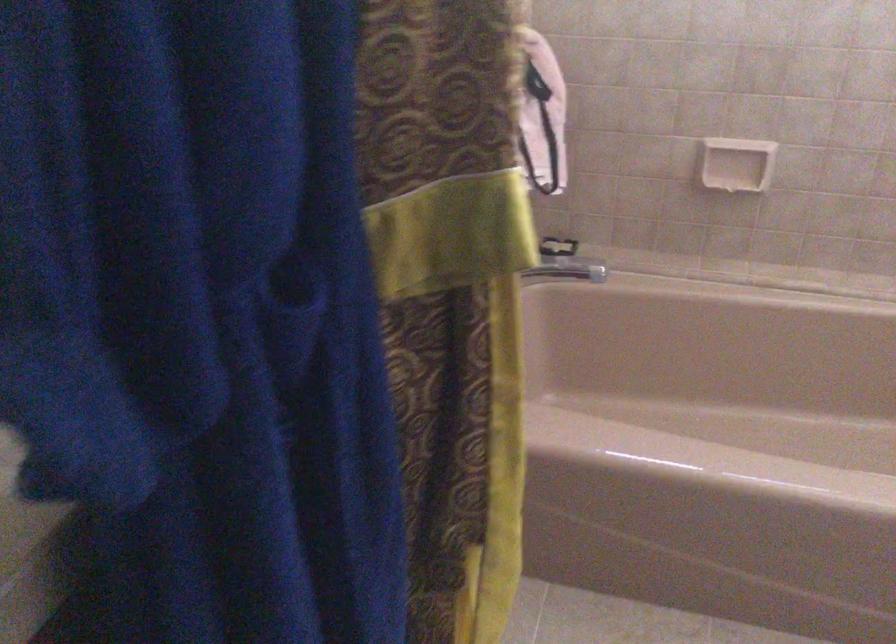
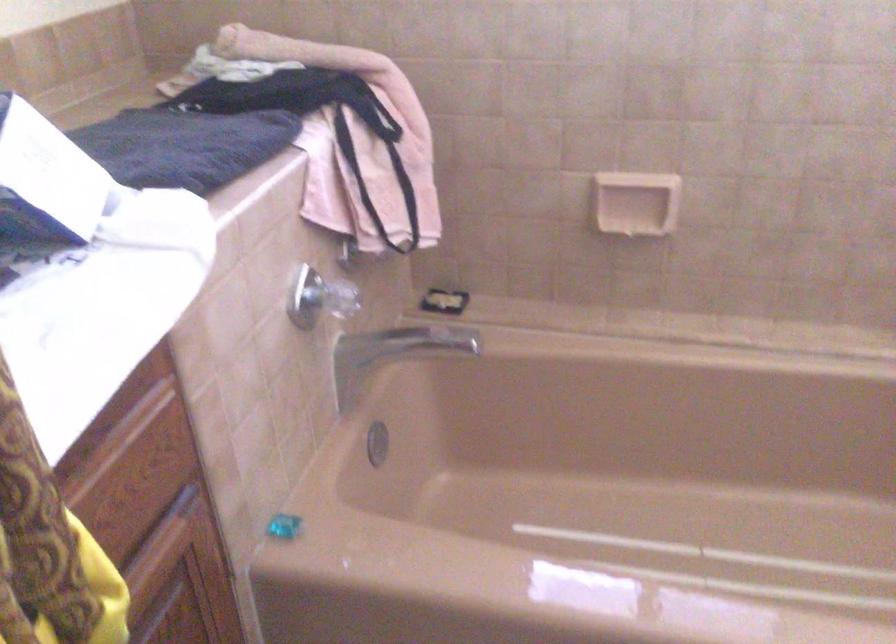
Which direction would the cameraman need to move to produce the second image?

The movement direction of the cameraman is right, forward.